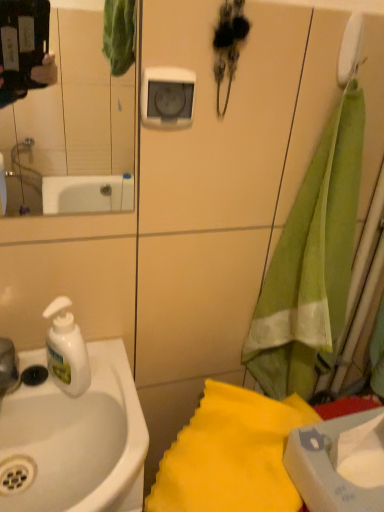
Question: Is point (1, 386) closer or farther from the camera than point (342, 306)?

Choices:
 (A) farther
 (B) closer

Answer: (B)

Question: Is white plastic faucet at left in front of or behind green fabric towel at right, the first beach towel positioned from the top, in the image?

Choices:
 (A) front
 (B) behind

Answer: (B)

Question: Based on their relative distances, which object is farther from the yellow fabric towel at lower right, the 2th beach towel in the top-to-bottom sequence?

Choices:
 (A) green fabric towel at right, the first beach towel positioned from the top
 (B) white plastic faucet at left
 (C) white matte soap dispenser at left
 (D) white glossy sink at left
 (E) clear glass mirror at upper left

Answer: (E)

Question: Which of these objects is positioned closest to the white glossy sink at left?

Choices:
 (A) yellow fabric towel at lower right, the 2th beach towel in the top-to-bottom sequence
 (B) clear glass mirror at upper left
 (C) white matte soap dispenser at left
 (D) white plastic faucet at left
 (E) green fabric towel at right, the first beach towel positioned from the top

Answer: (C)